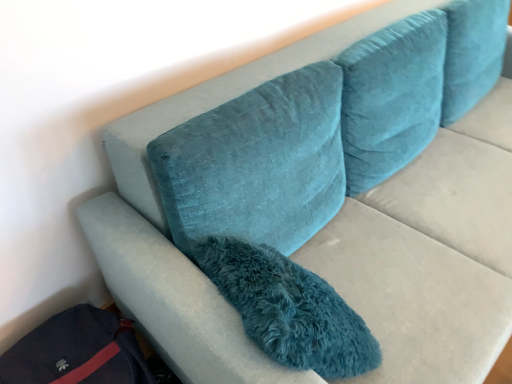
Image resolution: width=512 pixels, height=384 pixels. Find the location of `navy fabric shoulder bag at lower left`. navy fabric shoulder bag at lower left is located at coordinates (77, 351).

Measure the distance between point (22, 373) and camera.

A distance of 1.16 meters exists between point (22, 373) and camera.

What do you see at coordinates (77, 351) in the screenshot? The width and height of the screenshot is (512, 384). I see `navy fabric shoulder bag at lower left` at bounding box center [77, 351].

Locate an element on the screen. navy fabric shoulder bag at lower left is located at coordinates (77, 351).